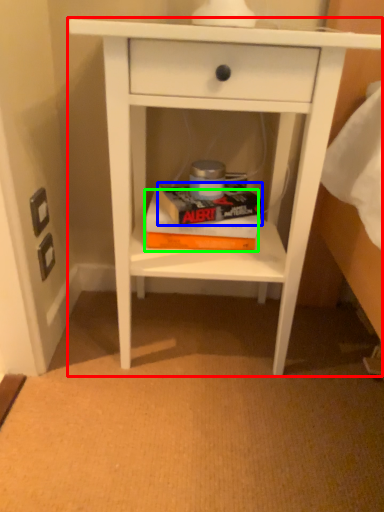
Question: Which is nearer to the nightstand (highlighted by a red box)? paperback book (highlighted by a blue box) or paperback book (highlighted by a green box).

Choices:
 (A) paperback book
 (B) paperback book

Answer: (B)